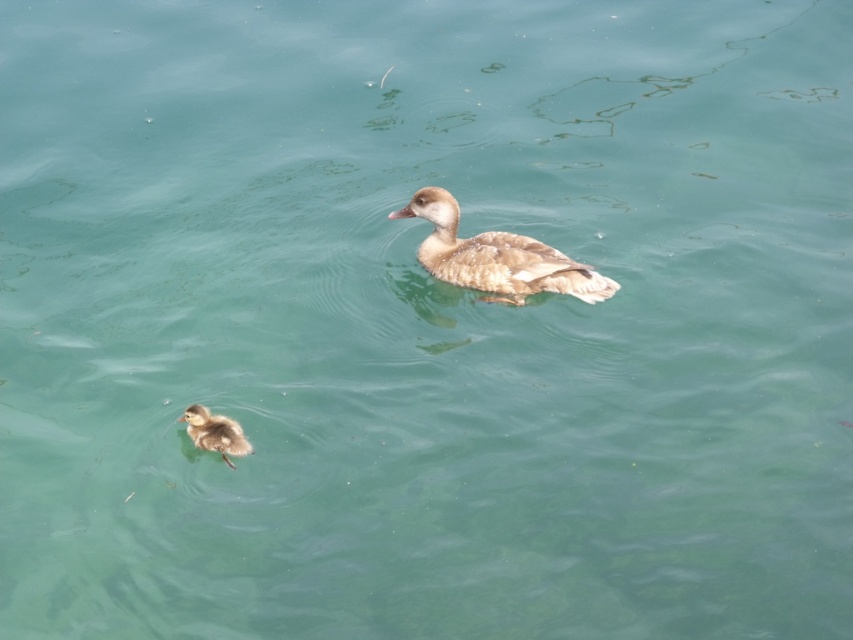
Is brown fuzzy duckling at center closer to camera compared to brown fluffy duckling at lower left?

That is False.

Who is positioned more to the left, brown fuzzy duckling at center or brown fluffy duckling at lower left?

Positioned to the left is brown fluffy duckling at lower left.

Is point (602, 288) positioned in front of point (198, 406)?

No, it is not.

The width and height of the screenshot is (853, 640). I want to click on brown fuzzy duckling at center, so click(496, 257).